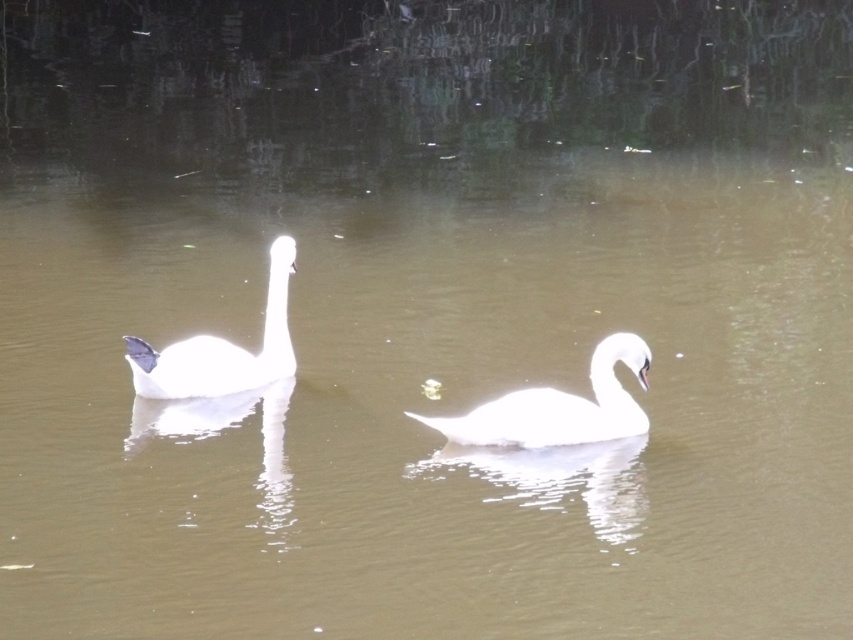
You are a wildlife photographer aiming to capture the tallest swan in the image. You see the white glossy swan at center and the white glossy swan at left. Which one should you focus on to get the tallest swan?

The white glossy swan at left is taller than the white glossy swan at center, so you should focus on the white glossy swan at left to capture the tallest one.

You are a photographer trying to capture a photo of the two swans. You notice two points in the image labeled as point 1 at coordinates point (x=616, y=417) and point 2 at coordinates point (x=160, y=388). Based on their positions, which point is closer to the camera?

Point 1 at coordinates point (x=616, y=417) is closer to the camera because it is in front of point 2 at coordinates point (x=160, y=388).

You are a wildlife photographer trying to capture a closeup shot of the swans. You have a camera with a lens that can focus on objects up to 2 meters away. You are currently positioned at the edge of the water. Which swan, the white glossy swan at center or the white glossy swan at left, is closer to you?

The white glossy swan at left is closer to the photographer because the description states that the white glossy swan at center might be wider than the white glossy swan at left, implying that the one at the center is further away and thus appears wider due to perspective.